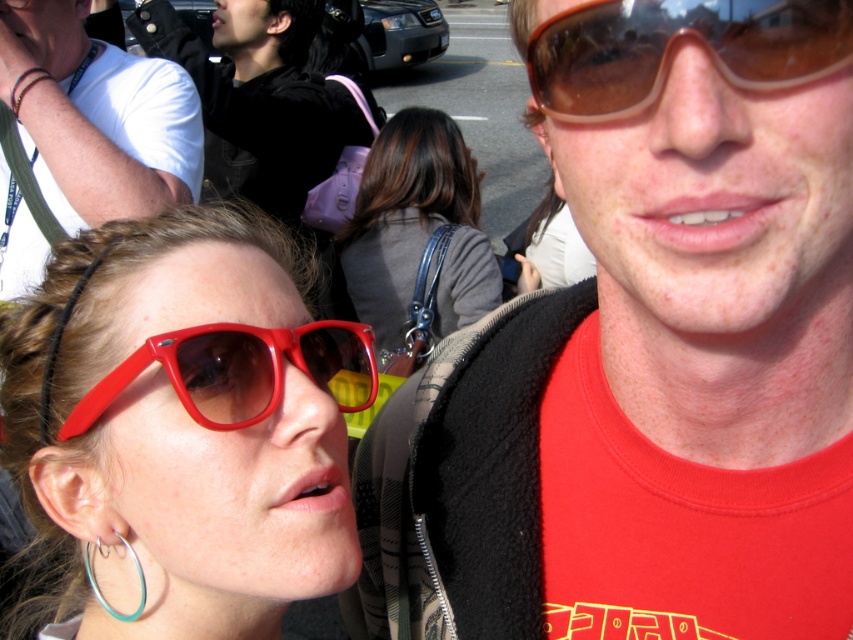
Does point (271, 570) come behind point (90, 557)?

No.

Is matte red sunglasses at upper left below teal metallic hoop at lower left?

Yes.

Measure the distance between point (193, 337) and camera.

Point (193, 337) and camera are 24.50 inches apart.

Where is `matte red sunglasses at upper left`? Image resolution: width=853 pixels, height=640 pixels. matte red sunglasses at upper left is located at coordinates (178, 429).

Does white fabric shirt at upper left lie in front of matte red sunglasses at center-left?

No, white fabric shirt at upper left is behind matte red sunglasses at center-left.

Does point (109, 109) come in front of point (120, 388)?

That is False.

Identify the location of white fabric shirt at upper left. (96, 116).

Does matte red sunglasses at center have a lesser height compared to brown translucent goggles at upper right?

No.

Does matte red sunglasses at center have a greater height compared to brown translucent goggles at upper right?

Correct, matte red sunglasses at center is much taller as brown translucent goggles at upper right.

Does point (809, 497) come behind point (567, 68)?

Yes, it is behind point (567, 68).

Find the location of `matte red sunglasses at center`. matte red sunglasses at center is located at coordinates (647, 355).